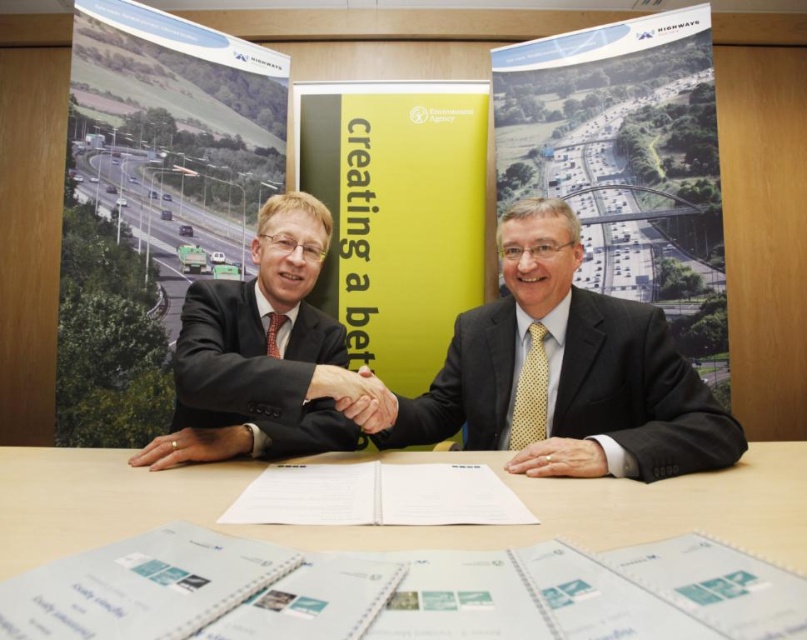
Question: Does gold metallic ring at center appear over golden textured hand at center?

Choices:
 (A) no
 (B) yes

Answer: (B)

Question: Which point appears closest to the camera in this image?

Choices:
 (A) (216, 429)
 (B) (613, 452)
 (C) (233, 304)
 (D) (345, 404)

Answer: (B)

Question: Is white paper at center smaller than gold metallic ring at center?

Choices:
 (A) no
 (B) yes

Answer: (A)

Question: Which point appears farthest from the camera in this image?

Choices:
 (A) (226, 442)
 (B) (352, 374)
 (C) (366, 397)
 (D) (164, 560)

Answer: (A)

Question: Where is dark gray suit at center located in relation to yellow matte poster at center in the image?

Choices:
 (A) below
 (B) above

Answer: (A)

Question: Which object is farther from the camera taking this photo?

Choices:
 (A) golden textured hand at center
 (B) white paper at center
 (C) gold metallic ring at center

Answer: (C)